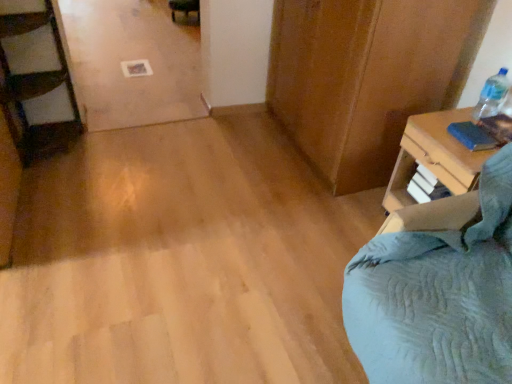
The image size is (512, 384). Find the location of `vacant space situated on the left part of blue matte book at upper right`. vacant space situated on the left part of blue matte book at upper right is located at coordinates (439, 133).